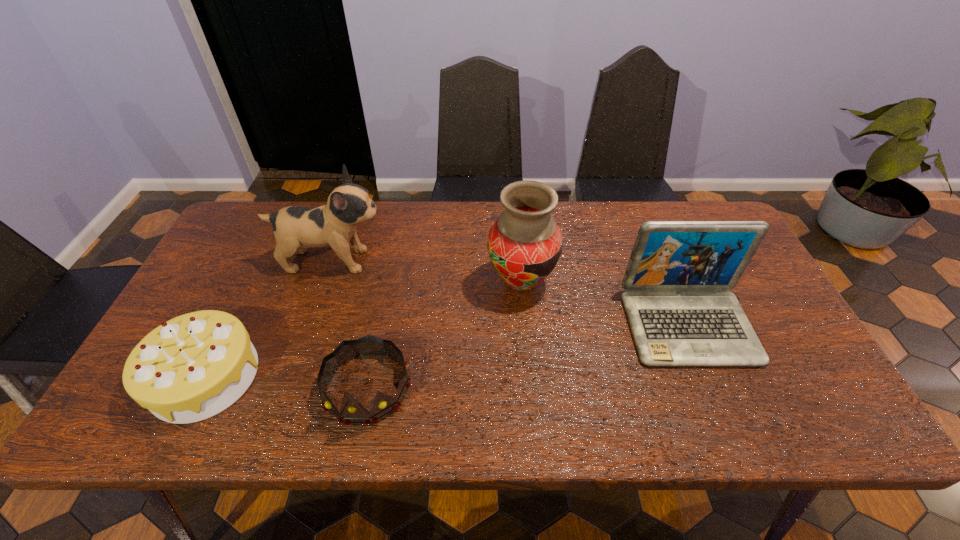
Where is `vase`? This screenshot has width=960, height=540. vase is located at coordinates (524, 244).

This screenshot has width=960, height=540. I want to click on puppy, so click(295, 228).

This screenshot has height=540, width=960. Find the location of `the rightmost object`. the rightmost object is located at coordinates (680, 312).

The width and height of the screenshot is (960, 540). Identify the location of birthday cake. (192, 367).

Find the location of a particular element. The width and height of the screenshot is (960, 540). tiara is located at coordinates (352, 412).

The height and width of the screenshot is (540, 960). I want to click on vacant space located 0.370m on the left of the second object from right to left, so click(x=356, y=282).

Find the location of `vacant region located at the face of the puppy`. vacant region located at the face of the puppy is located at coordinates coord(515,261).

Locate an element on the screen. vacant space located 0.120m on the screen of the rightmost object is located at coordinates (725, 415).

Identify the location of free space located on the right of the birthday cake. The image size is (960, 540). (402, 376).

Where is `object that is at the far edge`? object that is at the far edge is located at coordinates (295, 228).